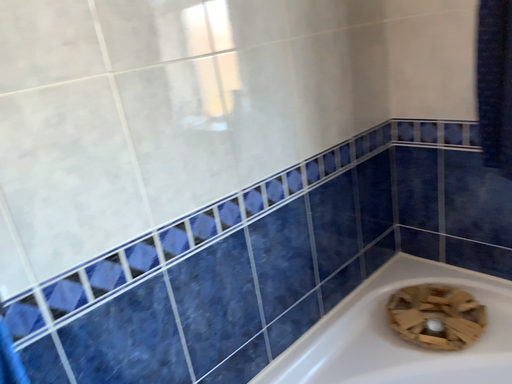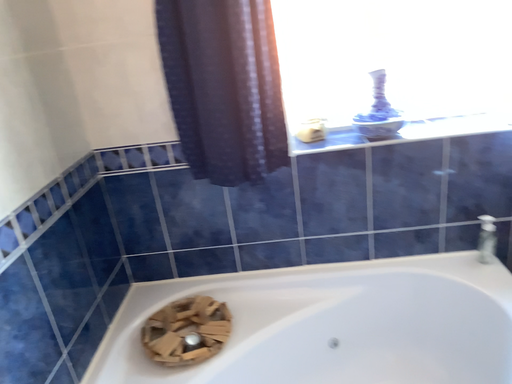
Question: Which way did the camera rotate in the video?

Choices:
 (A) rotated left
 (B) rotated right

Answer: (B)